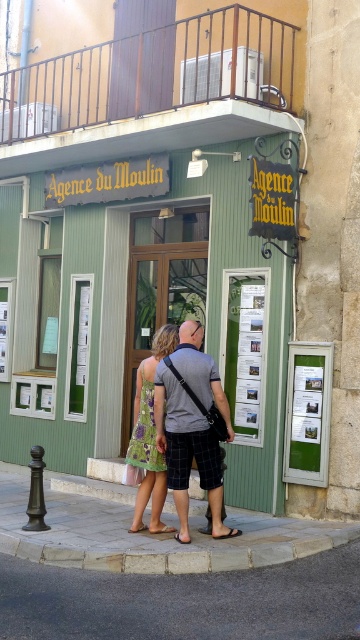
Question: Estimate the real-world distances between objects in this image. Which object is closer to the green floral dress at center?

Choices:
 (A) gray cotton t-shirt at center
 (B) gray stone pavement at lower center

Answer: (A)

Question: Which point is closer to the camera taking this photo?

Choices:
 (A) (146, 388)
 (B) (191, 452)

Answer: (B)

Question: Which point appears closest to the camera in this image?

Choices:
 (A) (156, 380)
 (B) (1, 499)

Answer: (A)

Question: Does gray stone pavement at lower center come behind green floral dress at center?

Choices:
 (A) no
 (B) yes

Answer: (A)

Question: In this image, where is green matte signboard at center located relative to gray cotton t-shirt at center?

Choices:
 (A) right
 (B) left

Answer: (B)

Question: Is green matte signboard at center smaller than gray stone pavement at lower center?

Choices:
 (A) yes
 (B) no

Answer: (A)